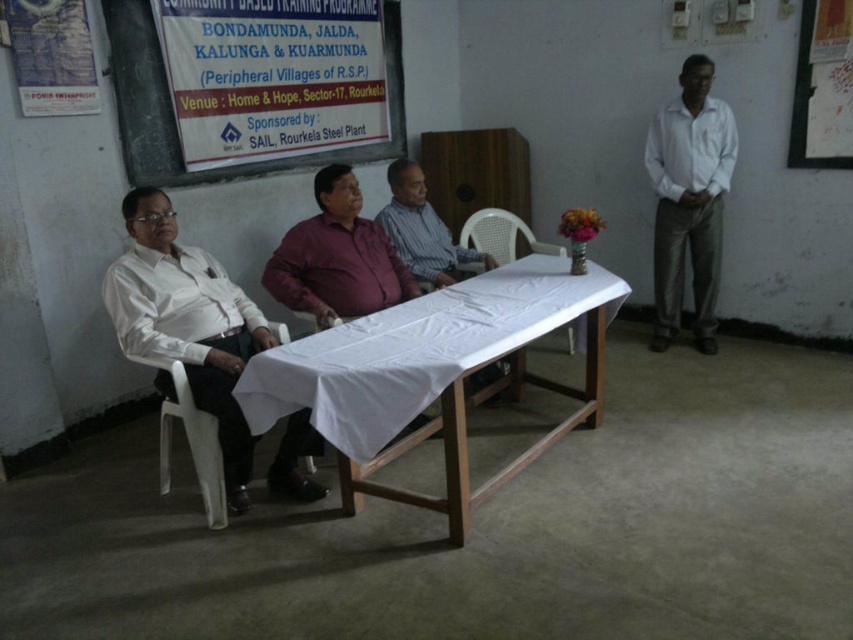
Consider the image. Between white wooden table at center and white smooth shirt at right, which one appears on the right side from the viewer's perspective?

Positioned to the right is white smooth shirt at right.

Does point (514, 316) lie behind point (663, 259)?

No, (514, 316) is in front of (663, 259).

What do you see at coordinates (434, 372) in the screenshot? I see `white wooden table at center` at bounding box center [434, 372].

You are a GUI agent. You are given a task and a screenshot of the screen. Output one action in this format:
    pyautogui.click(x=<x>, y=<y>)
    Task: Click on the white wooden table at center
    This screenshot has width=853, height=640.
    Given the screenshot: What is the action you would take?
    pyautogui.click(x=434, y=372)

Does white wooden table at center have a larger size compared to striped fabric shirt at center?

Yes.

What do you see at coordinates (434, 372) in the screenshot? The image size is (853, 640). I see `white wooden table at center` at bounding box center [434, 372].

What do you see at coordinates (434, 372) in the screenshot? The height and width of the screenshot is (640, 853). I see `white wooden table at center` at bounding box center [434, 372].

Locate an element on the screen. white wooden table at center is located at coordinates point(434,372).

Is white glossy shirt at left taller than white plastic chair at center?

Correct, white glossy shirt at left is much taller as white plastic chair at center.

Who is lower down, white glossy shirt at left or white plastic chair at center?

Positioned lower is white glossy shirt at left.

Describe the element at coordinates (187, 323) in the screenshot. I see `white glossy shirt at left` at that location.

Find the location of a particular element. The image size is (853, 640). white glossy shirt at left is located at coordinates (187, 323).